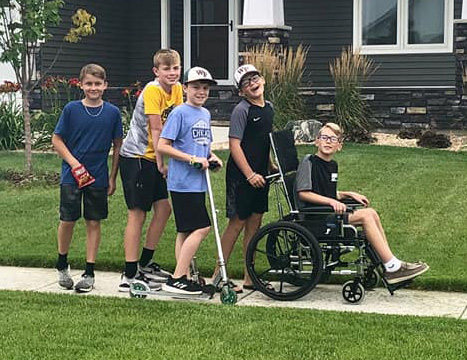
Locate an element on the screen. The image size is (467, 360). windows is located at coordinates (383, 20), (177, 31).